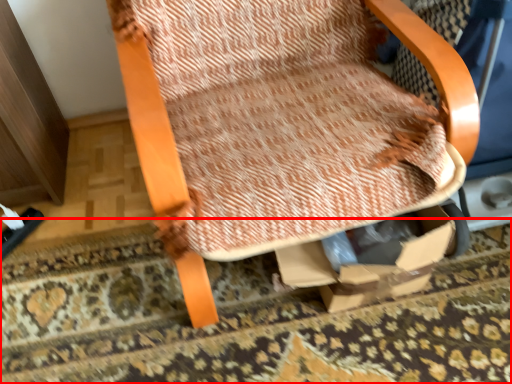
Question: From the image, what is the correct spatial relationship of mat (annotated by the red box) in relation to chair?

Choices:
 (A) left
 (B) right

Answer: (A)